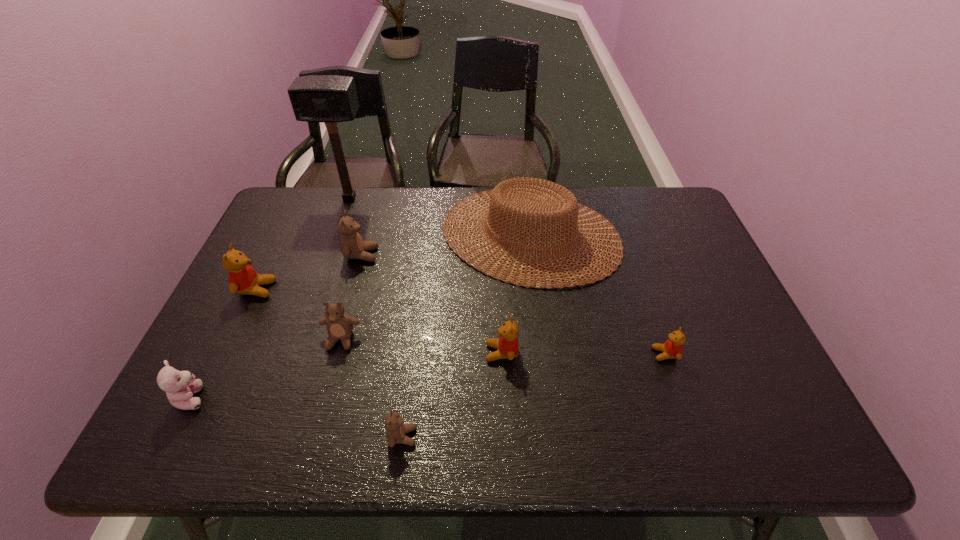
At what (x,y) coordinates should I click in order to perform the action: click on the tallest object. Please return your answer as a coordinate pair (x, y). Looking at the image, I should click on (330, 99).

The image size is (960, 540). I want to click on beige sunhat, so click(552, 205).

The height and width of the screenshot is (540, 960). Identify the location of the biggest brown teddy bear. (352, 245).

Find the location of a particular element. This screenshot has width=960, height=540. the farthest brown teddy bear is located at coordinates (352, 245).

The height and width of the screenshot is (540, 960). In order to click on the sixth nearest teddy bear in this screenshot , I will do `click(243, 279)`.

Where is `the biggest red teddy bear`? The width and height of the screenshot is (960, 540). the biggest red teddy bear is located at coordinates (243, 279).

Locate an element on the screen. Image resolution: width=960 pixels, height=540 pixels. the second biggest red teddy bear is located at coordinates (x=507, y=345).

At what (x,y) coordinates should I click in order to perform the action: click on the sixth teddy bear from left to right. Please return your answer as a coordinate pair (x, y). Looking at the image, I should click on (507, 345).

In order to click on the second biggest brown teddy bear in this screenshot , I will do `click(339, 325)`.

Find the location of `the second nearest object`. the second nearest object is located at coordinates (180, 386).